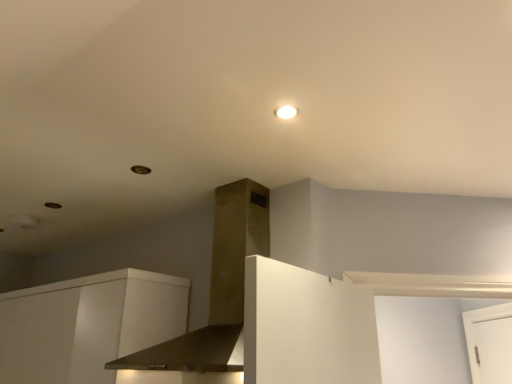
Question: Can white matte cabinet at lower left be found inside satin gold vent at center?

Choices:
 (A) yes
 (B) no

Answer: (B)

Question: Does satin gold vent at center have a smaller size compared to white matte cabinet at lower left?

Choices:
 (A) yes
 (B) no

Answer: (A)

Question: Is satin gold vent at center completely or partially outside of white matte cabinet at lower left?

Choices:
 (A) no
 (B) yes

Answer: (B)

Question: Is satin gold vent at center taller than white matte cabinet at lower left?

Choices:
 (A) yes
 (B) no

Answer: (A)

Question: Does satin gold vent at center have a greater width compared to white matte cabinet at lower left?

Choices:
 (A) no
 (B) yes

Answer: (B)

Question: Is white glossy light fixture at upper center spatially inside white matte cabinet at lower left, or outside of it?

Choices:
 (A) inside
 (B) outside

Answer: (B)

Question: Looking at their shapes, would you say white glossy light fixture at upper center is wider or thinner than white matte cabinet at lower left?

Choices:
 (A) wide
 (B) thin

Answer: (B)

Question: In the image, is white glossy light fixture at upper center on the left side or the right side of white matte cabinet at lower left?

Choices:
 (A) left
 (B) right

Answer: (B)

Question: Is white glossy light fixture at upper center taller or shorter than white matte cabinet at lower left?

Choices:
 (A) short
 (B) tall

Answer: (A)

Question: From the image's perspective, is white matte cabinet at lower left positioned above or below satin gold vent at center?

Choices:
 (A) below
 (B) above

Answer: (A)

Question: Considering their positions, is white matte cabinet at lower left located in front of or behind satin gold vent at center?

Choices:
 (A) front
 (B) behind

Answer: (B)

Question: Looking at their shapes, would you say white matte cabinet at lower left is wider or thinner than satin gold vent at center?

Choices:
 (A) wide
 (B) thin

Answer: (B)

Question: Considering the positions of white matte cabinet at lower left and satin gold vent at center in the image, is white matte cabinet at lower left taller or shorter than satin gold vent at center?

Choices:
 (A) tall
 (B) short

Answer: (B)

Question: From the image's perspective, is satin gold vent at center located above or below white glossy light fixture at upper center?

Choices:
 (A) below
 (B) above

Answer: (A)

Question: Is satin gold vent at center inside or outside of white glossy light fixture at upper center?

Choices:
 (A) inside
 (B) outside

Answer: (B)